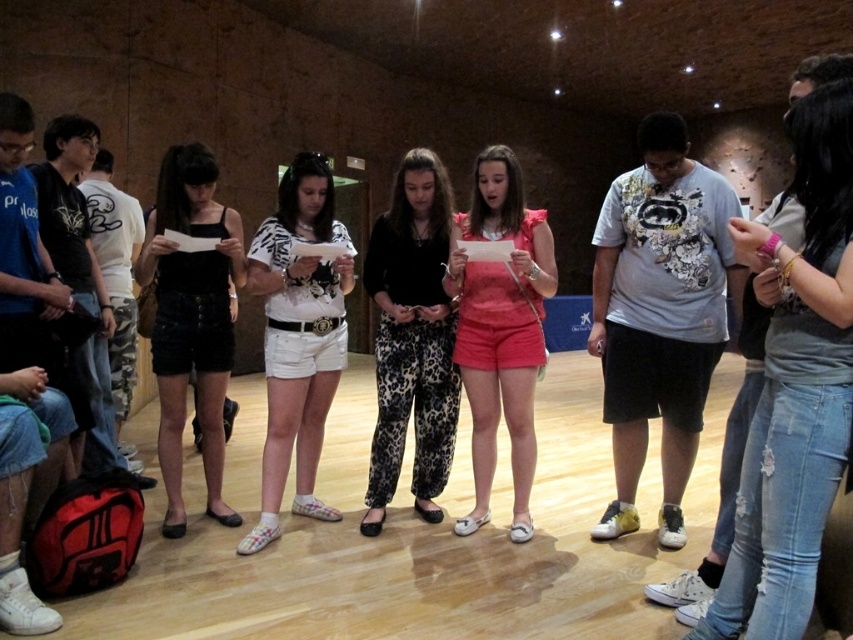
Who is taller, black leopard print pants at center or black denim shorts at center?

black denim shorts at center

Is black leopard print pants at center thinner than black denim shorts at center?

Correct, black leopard print pants at center's width is less than black denim shorts at center's.

Where is `black leopard print pants at center`? Image resolution: width=853 pixels, height=640 pixels. black leopard print pants at center is located at coordinates (412, 339).

Where is `black leopard print pants at center`? The image size is (853, 640). black leopard print pants at center is located at coordinates (412, 339).

Describe the element at coordinates (299, 337) in the screenshot. I see `white cotton shorts at center` at that location.

Which is behind, point (337, 244) or point (213, 406)?

The point (213, 406) is more distant.

Where is `white cotton shorts at center`? The height and width of the screenshot is (640, 853). white cotton shorts at center is located at coordinates (299, 337).

I want to click on white cotton shorts at center, so click(x=299, y=337).

Which is more to the right, white cotton shorts at center or matte pink shorts at center?

From the viewer's perspective, matte pink shorts at center appears more on the right side.

Is white cotton shorts at center thinner than matte pink shorts at center?

Incorrect, white cotton shorts at center's width is not less than matte pink shorts at center's.

Describe the element at coordinates (299, 337) in the screenshot. Image resolution: width=853 pixels, height=640 pixels. I see `white cotton shorts at center` at that location.

Locate an element on the screen. The height and width of the screenshot is (640, 853). white cotton shorts at center is located at coordinates (299, 337).